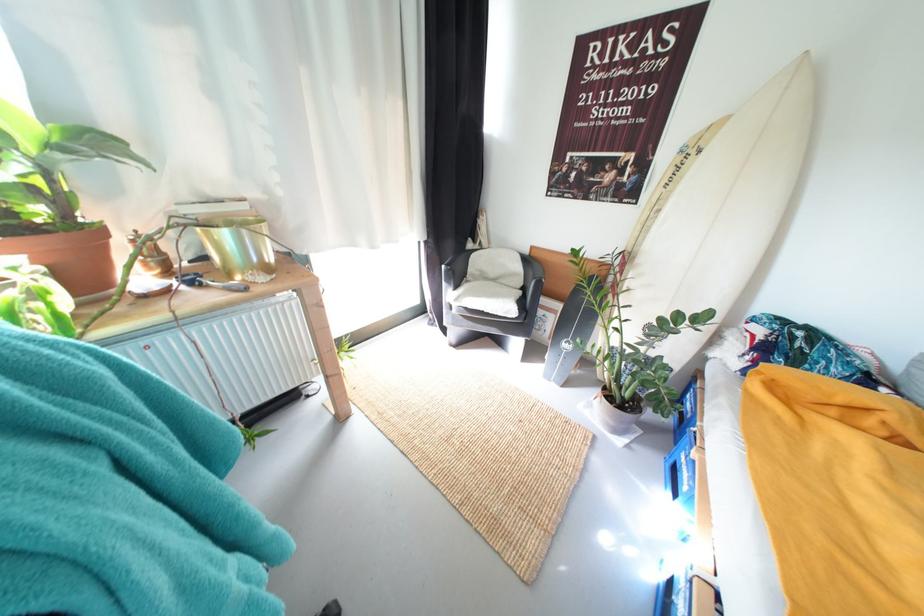
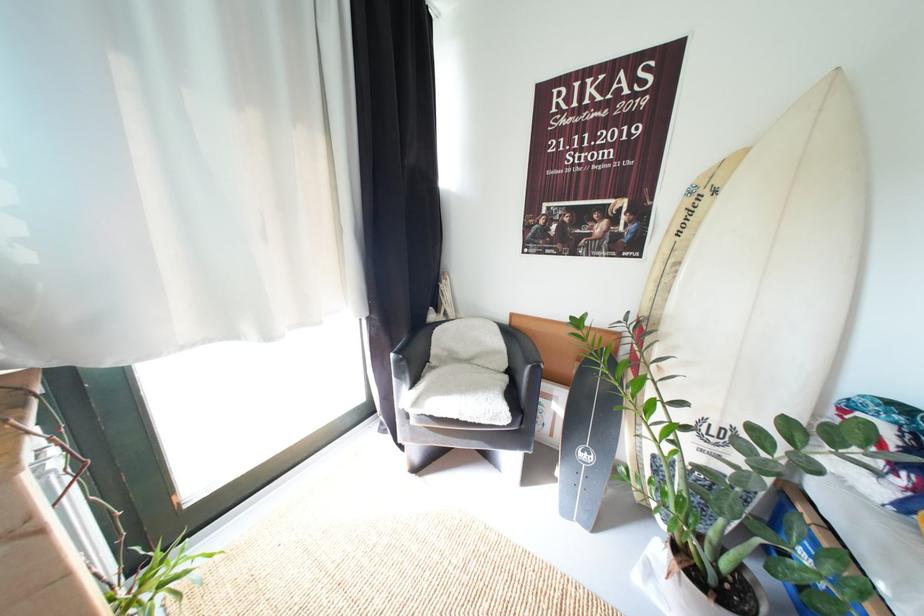
Question: Based on the continuous images, in which direction is the camera rotating? Reply with the corresponding letter.

Choices:
 (A) Left
 (B) Right
 (C) Up
 (D) Down

Answer: (C)